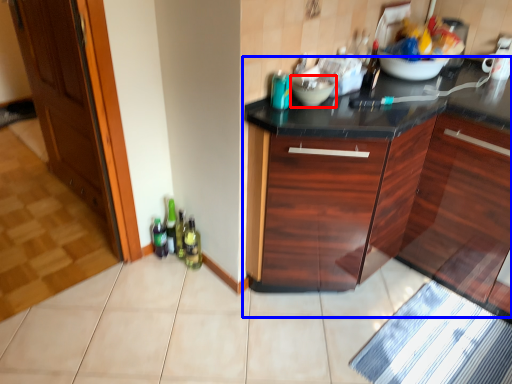
Question: Which of the following is the closest to the observer, mixing bowl (highlighted by a red box) or cabinetry (highlighted by a blue box)?

Choices:
 (A) mixing bowl
 (B) cabinetry

Answer: (B)